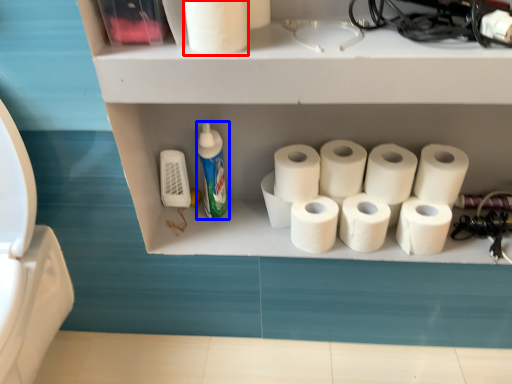
Question: Which point is closer to the camera, toilet paper (highlighted by a red box) or cleaning product (highlighted by a blue box)?

Choices:
 (A) toilet paper
 (B) cleaning product

Answer: (A)